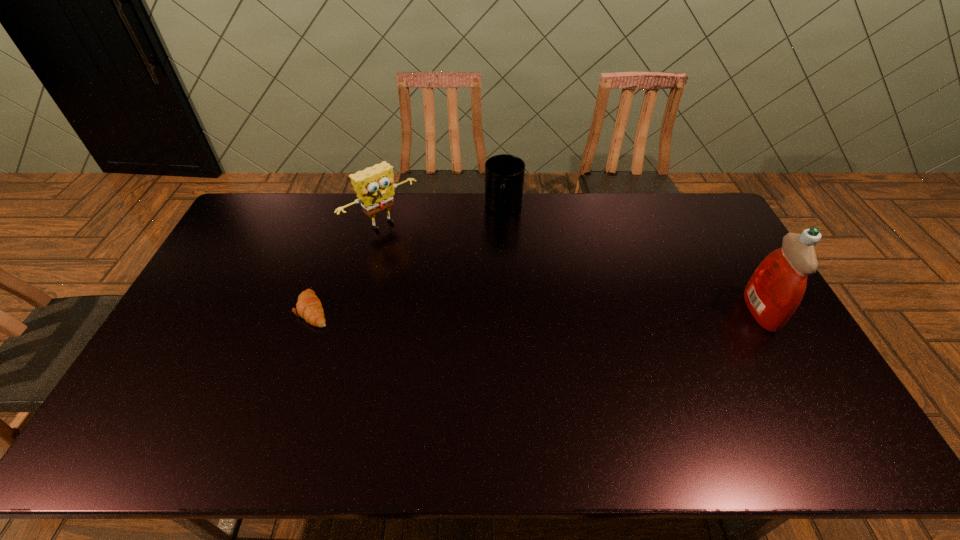
At what (x,y) coordinates should I click in order to perform the action: click on empty space between the second object from right to left and the sponge. Please return your answer as a coordinate pair (x, y). Looking at the image, I should click on (444, 216).

You are a GUI agent. You are given a task and a screenshot of the screen. Output one action in this format:
    pyautogui.click(x=<x>, y=<y>)
    Task: Click on the vacant area that lies between the crescent roll and the third shortest object
    The height and width of the screenshot is (540, 960).
    Given the screenshot: What is the action you would take?
    pyautogui.click(x=348, y=267)

This screenshot has width=960, height=540. Find the location of `object that is the third closest to the third object from left to right`. object that is the third closest to the third object from left to right is located at coordinates (776, 288).

Locate which object ranks third in proximity to the third tallest object. Please provide its 2D coordinates. Your answer should be formatted as a tuple, i.e. [(x, y)], where the tuple contains the x and y coordinates of a point satisfying the conditions above.

[(776, 288)]

Locate an element on the screen. This screenshot has height=540, width=960. blank space that satisfies the following two spatial constraints: 1. on the front side of the tallest object; 2. on the front surface of the third tallest object is located at coordinates click(x=510, y=310).